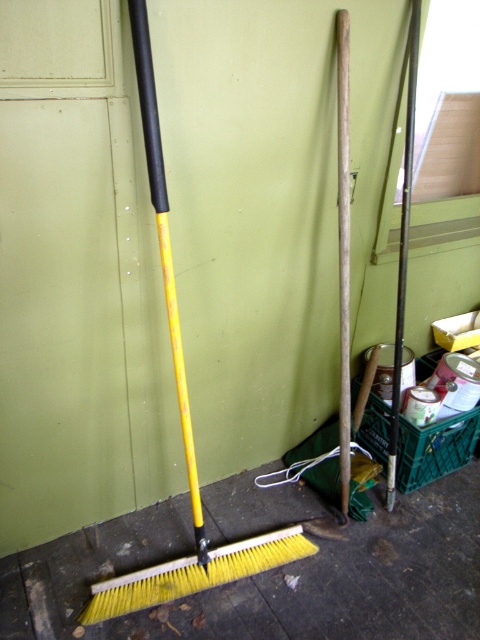
Does yellow plastic shovel at lower left have a lesser width compared to smooth wood pole at center?

Result: No, yellow plastic shovel at lower left is not thinner than smooth wood pole at center.

Does yellow plastic shovel at lower left appear under smooth wood pole at center?

Correct, yellow plastic shovel at lower left is located below smooth wood pole at center.

Image resolution: width=480 pixels, height=640 pixels. Find the location of `yellow plastic shovel at lower left`. yellow plastic shovel at lower left is located at coordinates (x=180, y=419).

Does yellow plastic shovel at lower left appear over yellow plastic brush at lower left?

Correct, yellow plastic shovel at lower left is located above yellow plastic brush at lower left.

Can you confirm if yellow plastic shovel at lower left is bigger than yellow plastic brush at lower left?

Correct, yellow plastic shovel at lower left is larger in size than yellow plastic brush at lower left.

Identify the location of yellow plastic shovel at lower left. This screenshot has width=480, height=640. (180, 419).

Which is in front, point (190, 566) or point (348, 29)?

Point (348, 29) is in front.

Is point (148, 570) in front of point (343, 92)?

No.

At what (x,y) coordinates should I click in order to perform the action: click on yellow plastic brush at lower left. Please return your answer as a coordinate pair (x, y). Looking at the image, I should click on (194, 573).